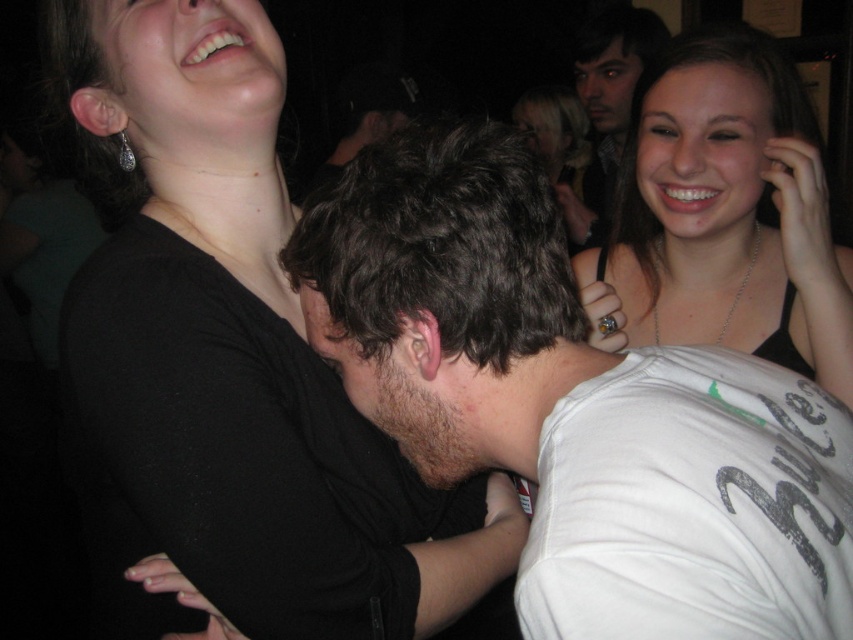
Between black matte shirt at upper left and matte black tank top at upper right, which one has more height?

black matte shirt at upper left

Can you confirm if black matte shirt at upper left is positioned below matte black tank top at upper right?

Yes, black matte shirt at upper left is below matte black tank top at upper right.

In order to click on black matte shirt at upper left in this screenshot , I will do `click(231, 360)`.

Between point (653, 168) and point (616, 157), which one is positioned in front?

Point (653, 168) is in front.

Between point (779, 108) and point (616, 13), which one is positioned behind?

The point (616, 13) is behind.

At what (x,y) coordinates should I click in order to perform the action: click on matte black tank top at upper right. Please return your answer as a coordinate pair (x, y). Looking at the image, I should click on (726, 212).

Locate an element on the screen. This screenshot has height=640, width=853. black matte shirt at upper left is located at coordinates (231, 360).

Can you confirm if black matte shirt at upper left is bigger than smooth brown hair at upper right?

No, black matte shirt at upper left is not bigger than smooth brown hair at upper right.

Who is more distant from viewer, (221,184) or (583,40)?

The point (583,40) is more distant.

In order to click on black matte shirt at upper left in this screenshot , I will do `click(231, 360)`.